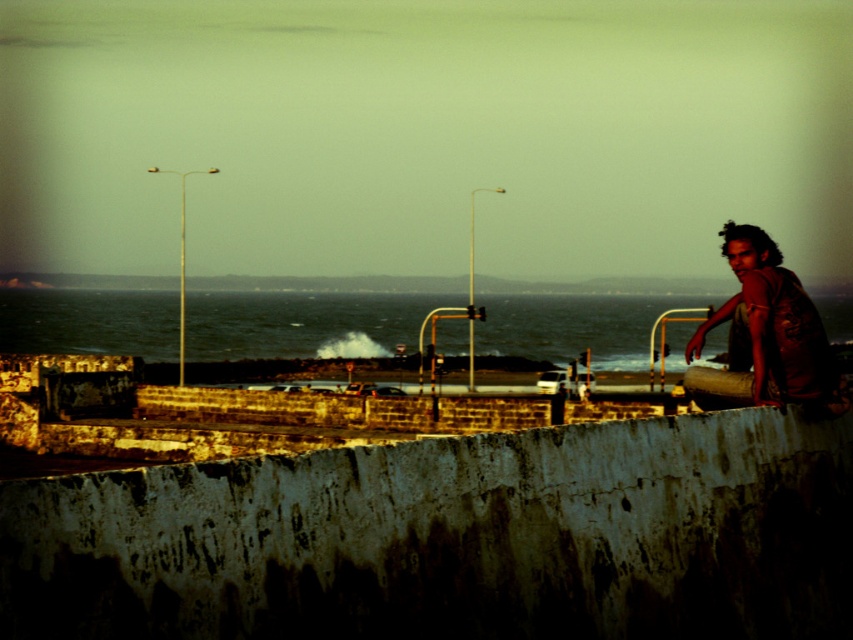
Question: Is dark blue water at center bigger than brown textured shirt at right?

Choices:
 (A) no
 (B) yes

Answer: (B)

Question: Among these objects, which one is farthest from the camera?

Choices:
 (A) rusty concrete barrier at lower center
 (B) brown textured shirt at right
 (C) dark blue water at center

Answer: (C)

Question: Can you confirm if rusty concrete barrier at lower center is bigger than brown textured shirt at right?

Choices:
 (A) no
 (B) yes

Answer: (A)

Question: Which of the following is the closest to the observer?

Choices:
 (A) rusty concrete barrier at lower center
 (B) brown textured shirt at right
 (C) dark blue water at center

Answer: (A)

Question: Is rusty concrete barrier at lower center smaller than brown textured shirt at right?

Choices:
 (A) no
 (B) yes

Answer: (B)

Question: Which point is farther to the camera?

Choices:
 (A) (335, 300)
 (B) (117, 545)

Answer: (A)